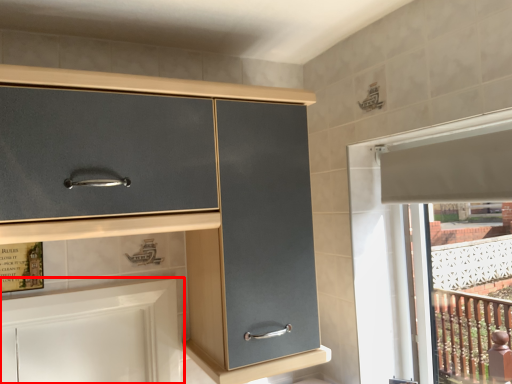
Question: From the image's perspective, what is the correct spatial relationship of cabinetry (annotated by the red box) in relation to cabinetry?

Choices:
 (A) above
 (B) below

Answer: (B)